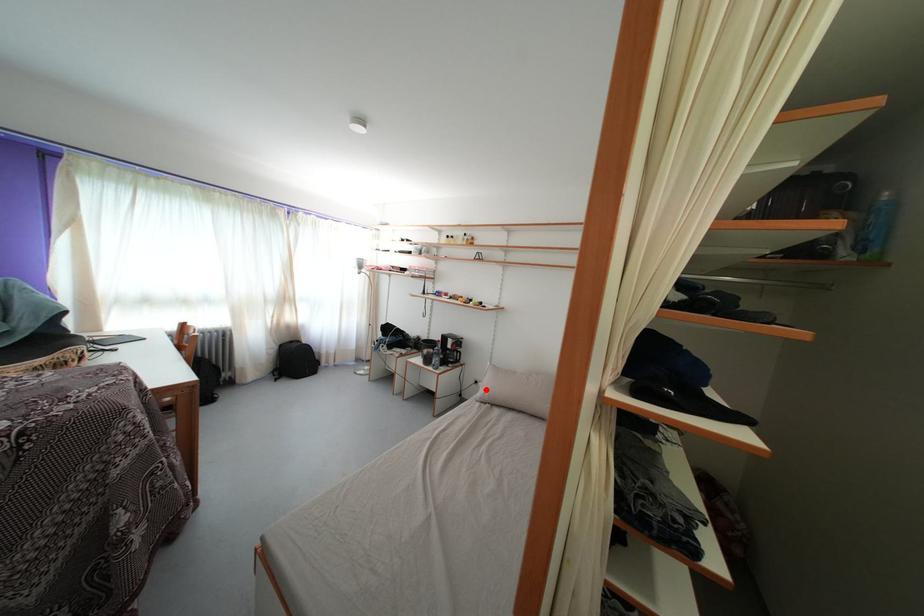
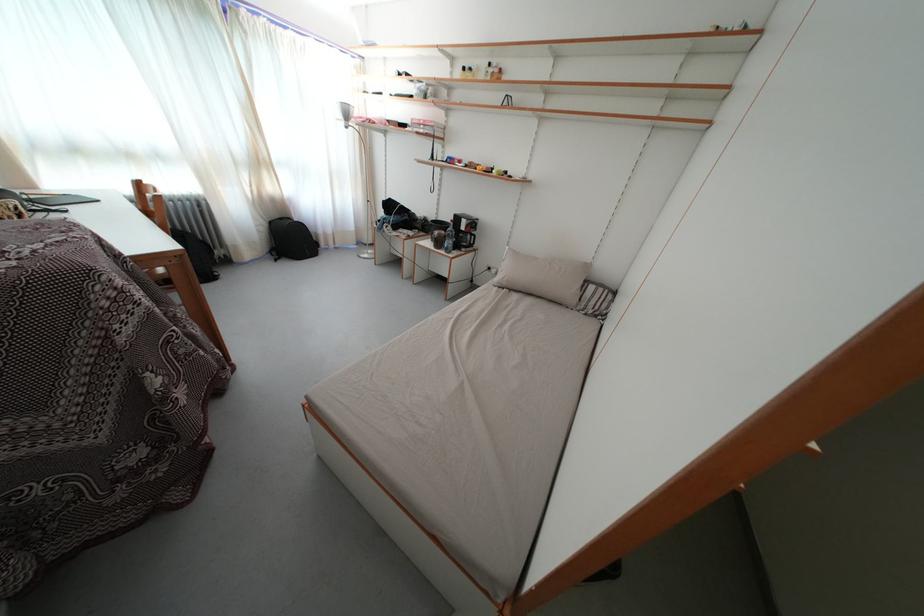
Question: A red point is marked in image1. In image2, is the corresponding 3D point closer to the camera or farther? Reply with the corresponding letter.

Choices:
 (A) The corresponding 3D point is closer.
 (B) The corresponding 3D point is farther.

Answer: (B)